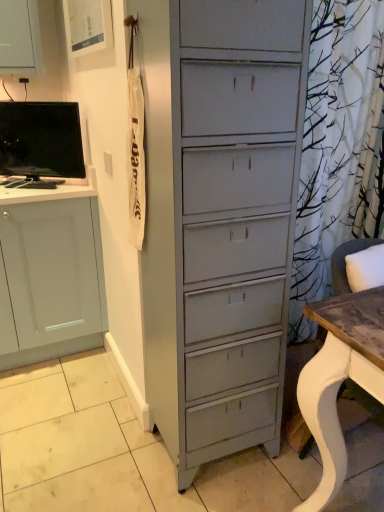
Question: From a real-world perspective, is matte black monitor at left above or below white wood desk at right?

Choices:
 (A) below
 (B) above

Answer: (B)

Question: In terms of width, does matte black monitor at left look wider or thinner when compared to white wood desk at right?

Choices:
 (A) wide
 (B) thin

Answer: (B)

Question: Is matte black monitor at left inside or outside of white wood desk at right?

Choices:
 (A) inside
 (B) outside

Answer: (B)

Question: Relative to matte black monitor at left, is white wood desk at right in front or behind?

Choices:
 (A) behind
 (B) front

Answer: (B)

Question: From a real-world perspective, is white wood desk at right physically located above or below matte black monitor at left?

Choices:
 (A) below
 (B) above

Answer: (A)

Question: Based on their sizes in the image, would you say white wood desk at right is bigger or smaller than matte black monitor at left?

Choices:
 (A) big
 (B) small

Answer: (A)

Question: From the image's perspective, is white wood desk at right positioned above or below matte black monitor at left?

Choices:
 (A) below
 (B) above

Answer: (A)